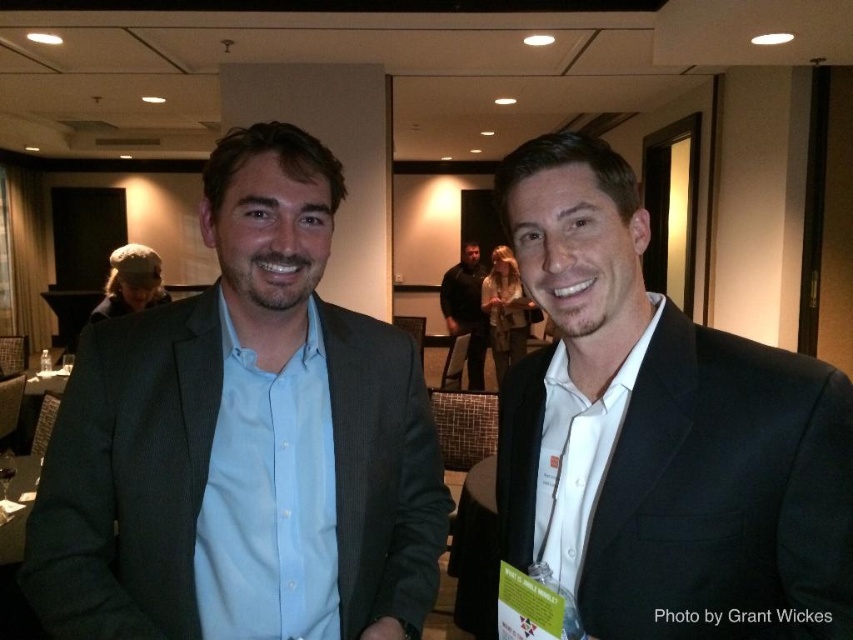
Does point (706, 545) come behind point (465, 282)?

No.

Does point (534, 480) lie behind point (480, 269)?

No.

This screenshot has height=640, width=853. Find the location of `matte black suit at right`. matte black suit at right is located at coordinates (660, 433).

The height and width of the screenshot is (640, 853). What do you see at coordinates (242, 442) in the screenshot?
I see `matte black suit at left` at bounding box center [242, 442].

Is matte black suit at left bigger than matte black suit at right?

Yes, matte black suit at left is bigger than matte black suit at right.

In order to click on matte black suit at left in this screenshot , I will do `click(242, 442)`.

Describe the element at coordinates (242, 442) in the screenshot. The image size is (853, 640). I see `matte black suit at left` at that location.

Does point (352, 499) come in front of point (456, 300)?

Yes, it is.

Between point (218, 545) and point (469, 333), which one is positioned in front?

Point (218, 545) is in front.

Locate an element on the screen. The width and height of the screenshot is (853, 640). matte black suit at left is located at coordinates (242, 442).